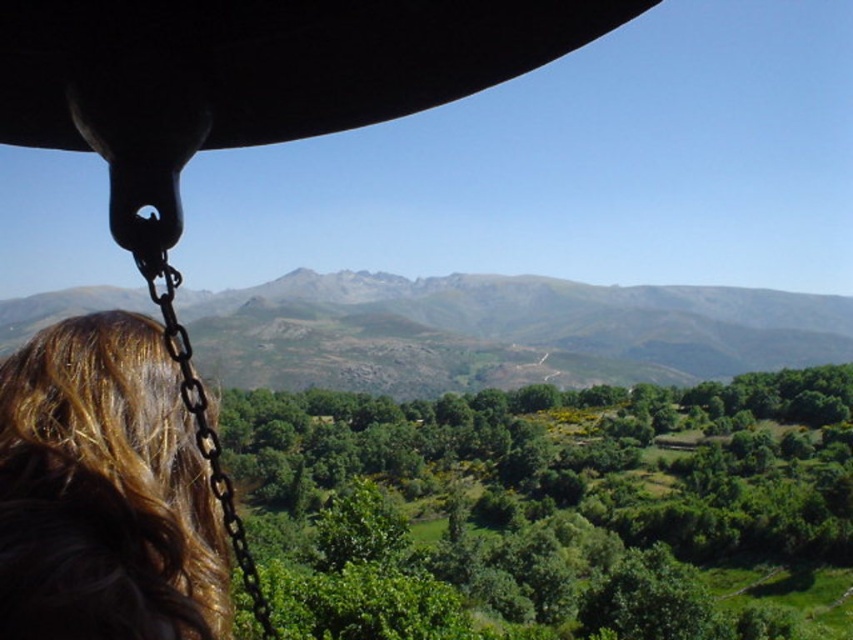
You are a passenger on a bus traveling through a mountainous region. You notice the rugged stone mountain at center and the brown wavy hair at lower left in your view. Can you determine if there is enough space between these two objects for a small animal, like a squirrel, to pass through?

The rugged stone mountain at center and brown wavy hair at lower left are 1870.37 feet apart from each other. Since the distance between them is vast, a small animal like a squirrel can easily pass through the space between them.

You are a passenger on a train and want to take a photo of the rugged stone mountain at center without any obstructions. Is the brown wavy hair at lower left blocking your view?

The brown wavy hair at lower left is behind the rugged stone mountain at center, so it will not block your view when taking a photo of the rugged stone mountain at center.

You are sitting in the vehicle and want to look at the scenery outside. There are two points marked on the window, point [508,337] and point [27,422]. Which point is closer to you?

Point [27,422] is closer to you because point [508,337] is behind it.